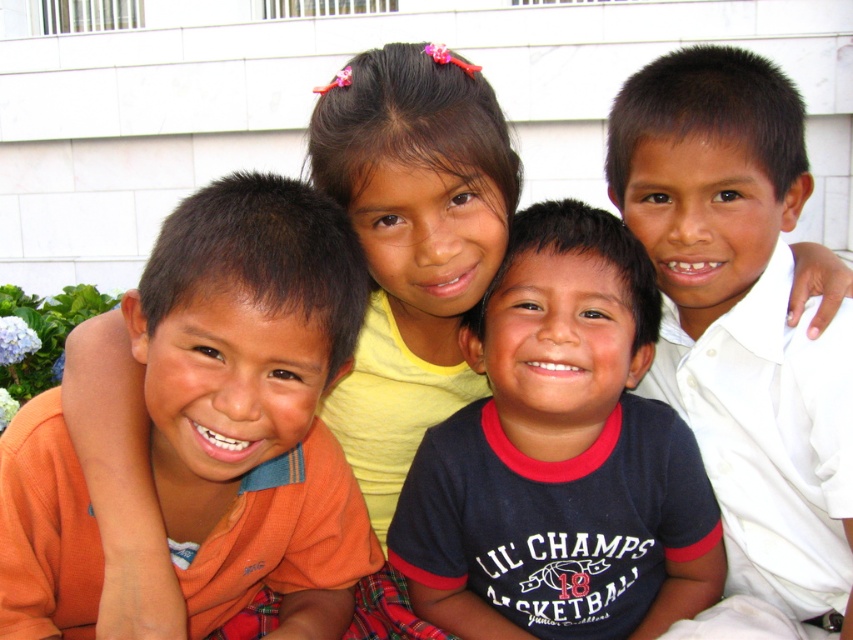
Question: From the image, what is the correct spatial relationship of dark blue jersey at center in relation to white smooth shirt at right?

Choices:
 (A) right
 (B) left

Answer: (B)

Question: Does orange cotton shirt at left appear on the right side of white smooth shirt at right?

Choices:
 (A) no
 (B) yes

Answer: (A)

Question: Where is orange cotton shirt at left located in relation to white smooth shirt at right in the image?

Choices:
 (A) left
 (B) right

Answer: (A)

Question: Among these objects, which one is nearest to the camera?

Choices:
 (A) dark blue jersey at center
 (B) orange cotton shirt at left
 (C) white smooth shirt at right

Answer: (B)

Question: Which of the following is the closest to the observer?

Choices:
 (A) dark blue jersey at center
 (B) orange cotton shirt at left
 (C) white smooth shirt at right

Answer: (B)

Question: Which point is farther from the camera taking this photo?

Choices:
 (A) (637, 195)
 (B) (509, 524)

Answer: (B)